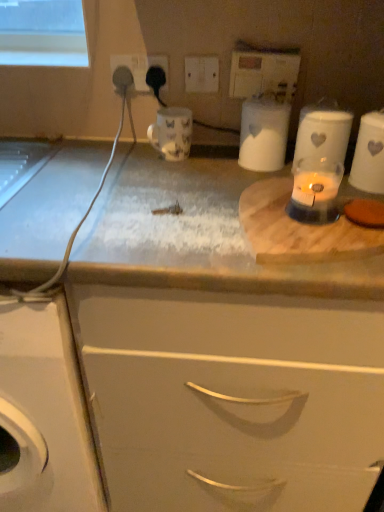
Question: In terms of height, does white matte container at upper center, the second appliance in the right-to-left sequence, look taller or shorter compared to translucent glass candle at center?

Choices:
 (A) short
 (B) tall

Answer: (B)

Question: Considering the relative positions of white matte container at upper center, the second appliance in the right-to-left sequence, and translucent glass candle at center in the image provided, is white matte container at upper center, the second appliance in the right-to-left sequence, to the left or to the right of translucent glass candle at center?

Choices:
 (A) left
 (B) right

Answer: (A)

Question: Based on their relative distances, which object is farther from the white matte container at upper center, which is the second appliance from left to right?

Choices:
 (A) white plastic switch at upper center, which is the 3th electric outlet in left-to-right order
 (B) translucent glass candle at center
 (C) black plastic socket at upper center, the fourth electric outlet positioned from the right
 (D) white plastic electric outlet at upper center, which is the fourth electric outlet in left-to-right order
 (E) white ceramic jar at upper right, placed as the 1th appliance when sorted from right to left

Answer: (C)

Question: Which object is positioned closest to the black plastic socket at upper center, the fourth electric outlet positioned from the right?

Choices:
 (A) white matte cabinet at center
 (B) translucent glass candle at center
 (C) white ceramic jar at upper right, placed as the 1th appliance when sorted from right to left
 (D) black plastic electric outlet at upper center, acting as the 3th electric outlet starting from the right
 (E) white matte container at upper center, the second appliance in the right-to-left sequence

Answer: (D)